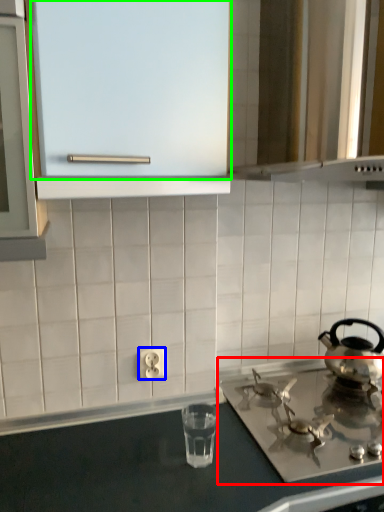
Question: Estimate the real-world distances between objects in this image. Which object is closer to gas stove (highlighted by a red box), electric outlet (highlighted by a blue box) or glass door (highlighted by a green box)?

Choices:
 (A) electric outlet
 (B) glass door

Answer: (A)